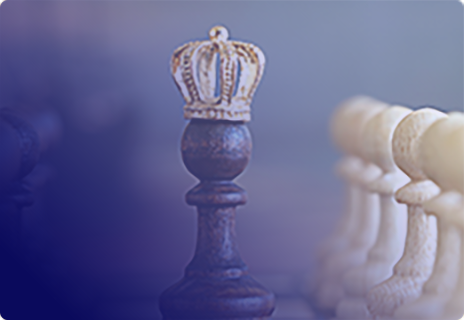
The height and width of the screenshot is (320, 464). What are the coordinates of `chess baord` in the screenshot? It's located at (289, 304).